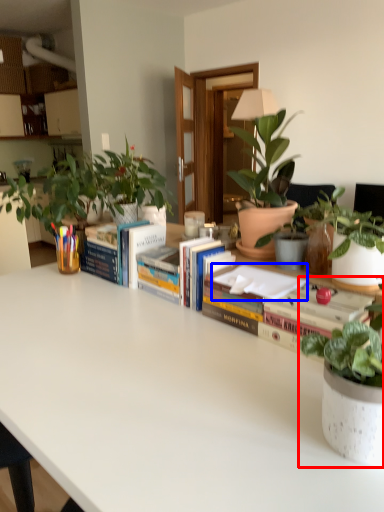
Question: Which of the following is the farthest to the observer, houseplant (highlighted by a red box) or paperback book (highlighted by a blue box)?

Choices:
 (A) houseplant
 (B) paperback book

Answer: (B)